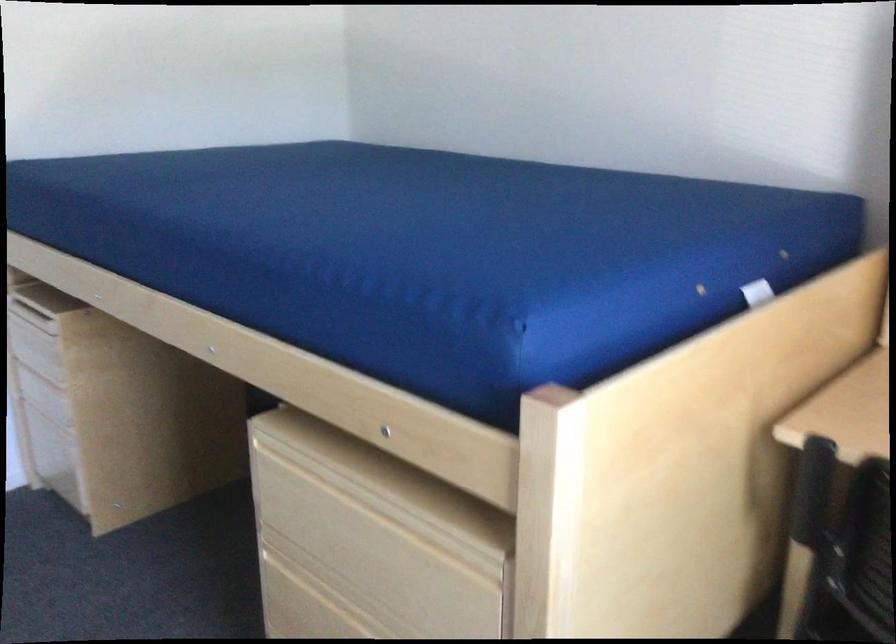
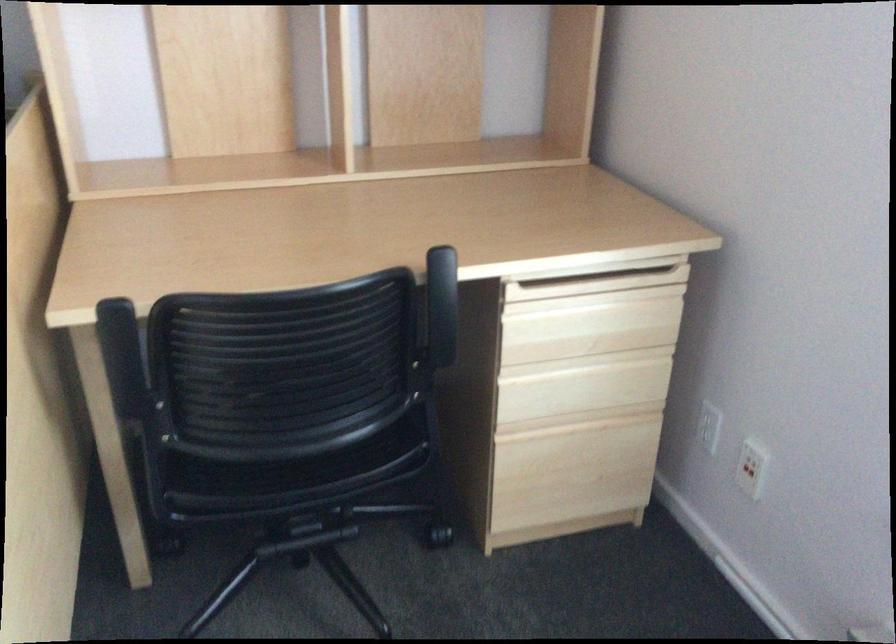
In the second image, find the point that corresponds to point (805, 491) in the first image.

(123, 360)